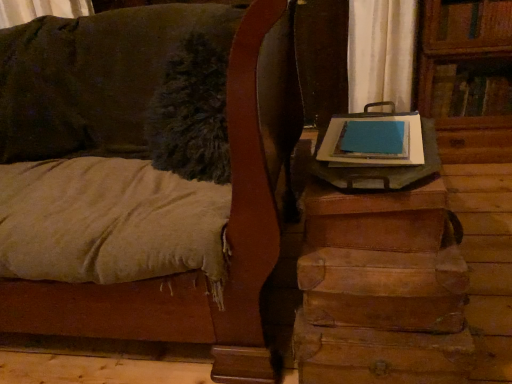
Question: Does brown leather suitcase at lower right come in front of wooden trunk at right?

Choices:
 (A) yes
 (B) no

Answer: (B)

Question: From the image's perspective, is brown leather suitcase at lower right on top of wooden trunk at right?

Choices:
 (A) no
 (B) yes

Answer: (A)

Question: Is brown leather suitcase at lower right taller than wooden trunk at right?

Choices:
 (A) no
 (B) yes

Answer: (A)

Question: Are brown leather suitcase at lower right and wooden trunk at right beside each other?

Choices:
 (A) yes
 (B) no

Answer: (B)

Question: Does brown leather suitcase at lower right turn towards wooden trunk at right?

Choices:
 (A) no
 (B) yes

Answer: (A)

Question: From a real-world perspective, is brown leather suitcase at lower right located higher than wooden trunk at right?

Choices:
 (A) no
 (B) yes

Answer: (A)

Question: From the image's perspective, is wooden trunk at right under brown leather suitcase at lower right?

Choices:
 (A) no
 (B) yes

Answer: (A)

Question: Can you confirm if wooden trunk at right is positioned to the left of brown leather suitcase at lower right?

Choices:
 (A) no
 (B) yes

Answer: (B)

Question: Is wooden trunk at right behind brown leather suitcase at lower right?

Choices:
 (A) yes
 (B) no

Answer: (B)

Question: Can you confirm if wooden trunk at right is positioned to the right of brown leather suitcase at lower right?

Choices:
 (A) yes
 (B) no

Answer: (B)

Question: From the image's perspective, is wooden trunk at right on top of brown leather suitcase at lower right?

Choices:
 (A) no
 (B) yes

Answer: (B)

Question: Can you confirm if wooden trunk at right is smaller than brown leather suitcase at lower right?

Choices:
 (A) no
 (B) yes

Answer: (A)

Question: In the image, is brown leather suitcase at lower right positioned in front of or behind wooden trunk at right?

Choices:
 (A) front
 (B) behind

Answer: (B)